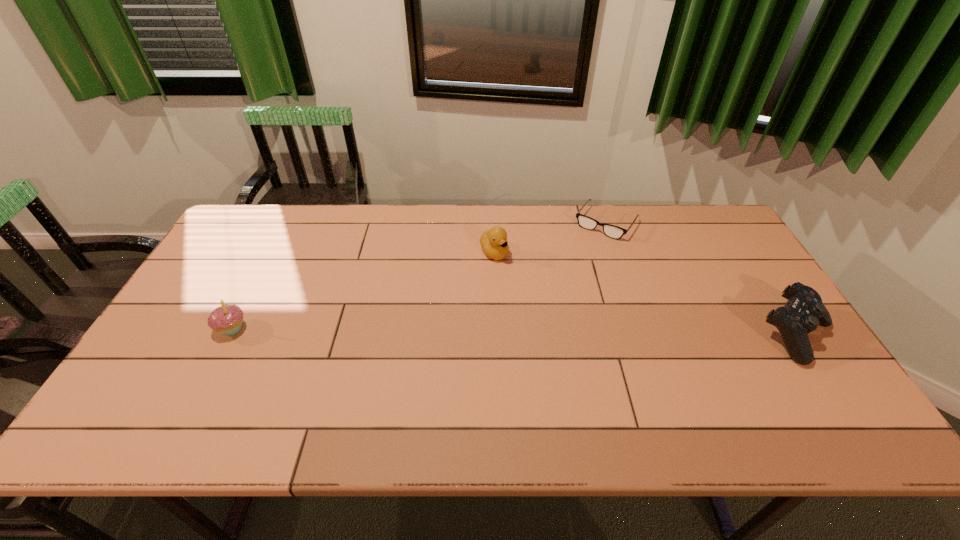
Locate an element on the screen. Image resolution: width=960 pixels, height=540 pixels. free point located on the front-facing side of the third object from left to right is located at coordinates (576, 263).

You are a GUI agent. You are given a task and a screenshot of the screen. Output one action in this format:
    pyautogui.click(x=<x>, y=<y>)
    Task: Click on the free space located 0.170m on the front-facing side of the third object from left to right
    The height and width of the screenshot is (540, 960).
    Given the screenshot: What is the action you would take?
    pyautogui.click(x=572, y=268)

The height and width of the screenshot is (540, 960). Find the location of `vacant space located on the front-facing side of the third object from left to right`. vacant space located on the front-facing side of the third object from left to right is located at coordinates (555, 292).

At what (x,y) coordinates should I click in order to perform the action: click on duckling positioned at the far edge. Please return your answer as a coordinate pair (x, y). This screenshot has width=960, height=540. Looking at the image, I should click on (494, 243).

Locate an element on the screen. This screenshot has width=960, height=540. spectacles that is at the far edge is located at coordinates click(x=612, y=231).

This screenshot has height=540, width=960. I want to click on object present at the left edge, so click(227, 318).

The height and width of the screenshot is (540, 960). I want to click on object situated at the right edge, so 804,311.

The height and width of the screenshot is (540, 960). Identify the location of free space at the far edge of the desktop. (307, 242).

Find the location of `vacant space at the near edge of the desktop`. vacant space at the near edge of the desktop is located at coordinates (235, 373).

At what (x,y) coordinates should I click in order to perform the action: click on vacant space at the left edge. Please return your answer as a coordinate pair (x, y). Looking at the image, I should click on (192, 322).